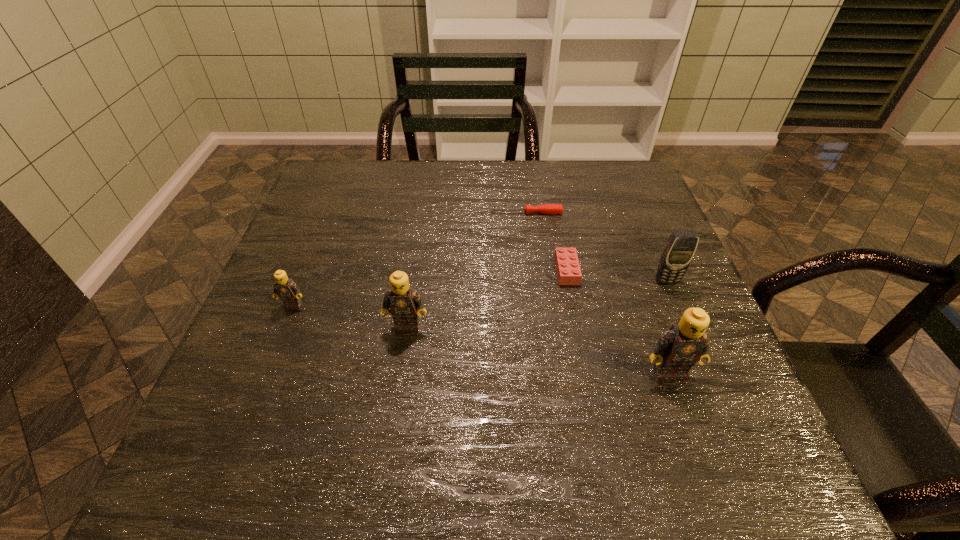
Find the location of `object present at the left edge`. object present at the left edge is located at coordinates (286, 289).

Where is `Lego situated at the right edge`? The image size is (960, 540). Lego situated at the right edge is located at coordinates (678, 349).

This screenshot has height=540, width=960. In order to click on cellular telephone present at the right edge in this screenshot , I will do `click(681, 246)`.

This screenshot has height=540, width=960. I want to click on object that is at the near right corner, so click(678, 349).

Where is `vacant area at the far edge of the desktop`? This screenshot has width=960, height=540. vacant area at the far edge of the desktop is located at coordinates (526, 168).

I want to click on vacant space at the near edge, so click(474, 422).

At what (x,y) coordinates should I click in order to perform the action: click on blank space at the left edge of the desktop. Please return your answer as a coordinate pair (x, y). The image size is (960, 540). Looking at the image, I should click on (301, 263).

Find the location of `blank space at the right edge of the desktop`. blank space at the right edge of the desktop is located at coordinates (653, 325).

Image resolution: width=960 pixels, height=540 pixels. I want to click on blank area at the far left corner, so click(344, 199).

This screenshot has height=540, width=960. In order to click on free space at the near left corner of the desktop in this screenshot , I will do `click(244, 409)`.